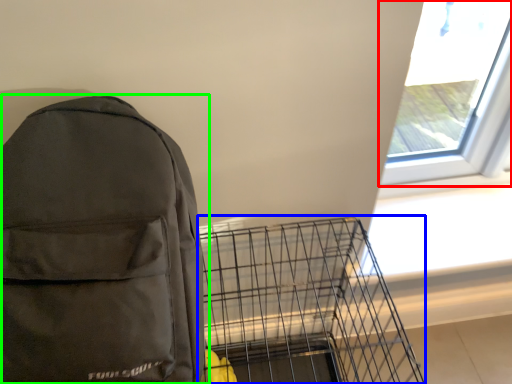
Question: Which object is positioned closest to window (highlighted by a red box)? Select from bird cage (highlighted by a blue box) and backpack (highlighted by a green box).

Choices:
 (A) bird cage
 (B) backpack

Answer: (A)